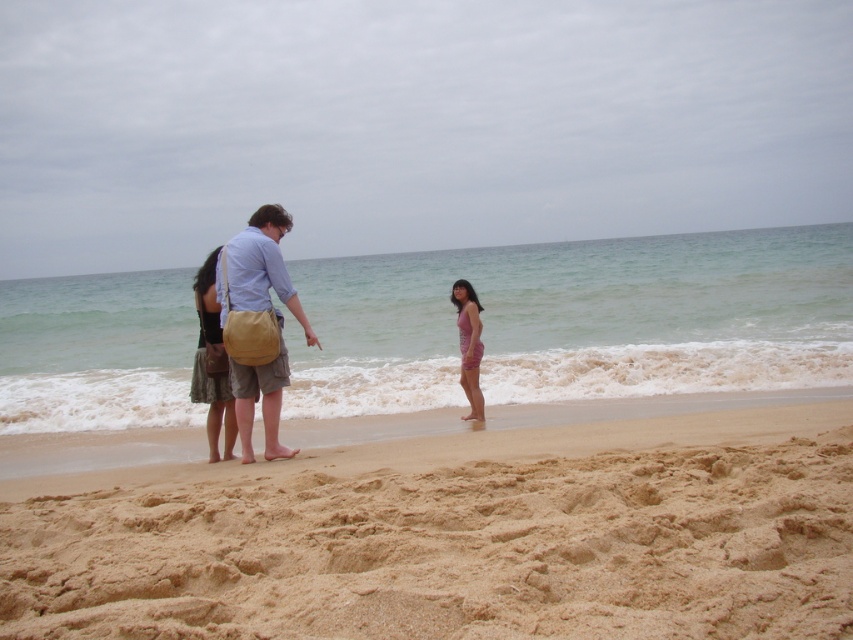
Question: Is light brown canvas bag at center further to camera compared to purple fabric dress at center?

Choices:
 (A) no
 (B) yes

Answer: (A)

Question: Does light brown canvas bag at center lie in front of black textured dress at center?

Choices:
 (A) no
 (B) yes

Answer: (B)

Question: Among these objects, which one is nearest to the camera?

Choices:
 (A) purple fabric dress at center
 (B) light brown canvas bag at center

Answer: (B)

Question: Which of the following is the closest to the observer?

Choices:
 (A) (729, 556)
 (B) (196, 342)

Answer: (A)

Question: Estimate the real-world distances between objects in this image. Which object is farther from the black textured dress at center?

Choices:
 (A) purple fabric dress at center
 (B) fine-grained sand at lower center
 (C) light brown canvas bag at center

Answer: (A)

Question: Does black textured dress at center have a greater width compared to purple fabric dress at center?

Choices:
 (A) yes
 (B) no

Answer: (A)